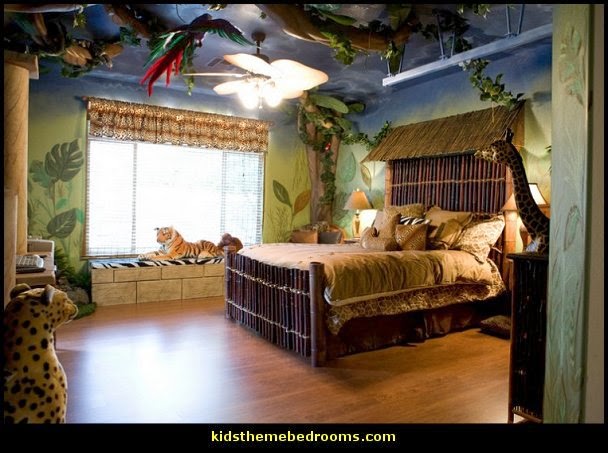
Find the location of a particular element. right of bed is located at coordinates (515, 164).